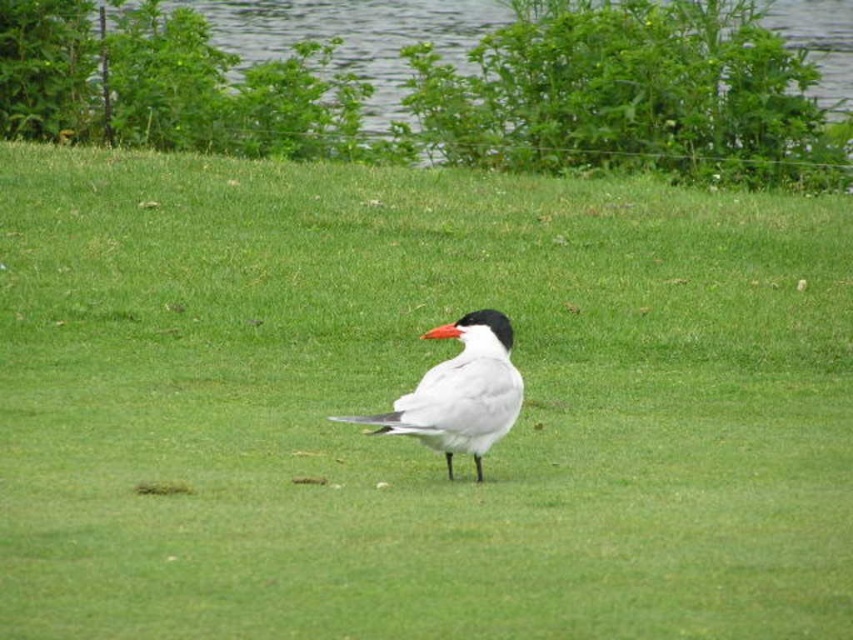
Who is positioned more to the left, green grass at upper center or white glossy bird at center?

white glossy bird at center is more to the left.

Is green grass at upper center above white glossy bird at center?

Yes, green grass at upper center is above white glossy bird at center.

Find the location of `green grass at upper center`. green grass at upper center is located at coordinates (440, 92).